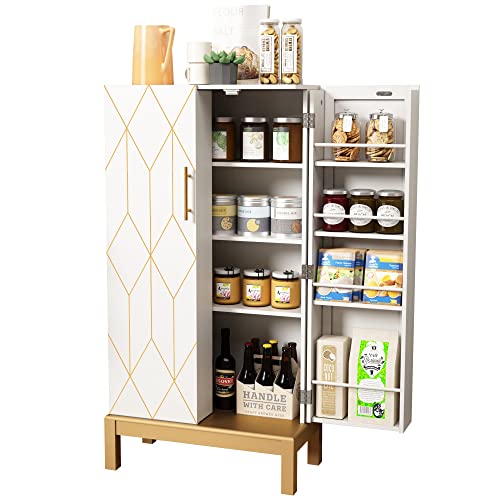
I want to click on items stored on right side of pantry, so click(383, 139), click(335, 137), click(381, 203), click(360, 204), click(342, 206), click(337, 276), click(355, 277), click(377, 277), click(386, 383), click(335, 379).